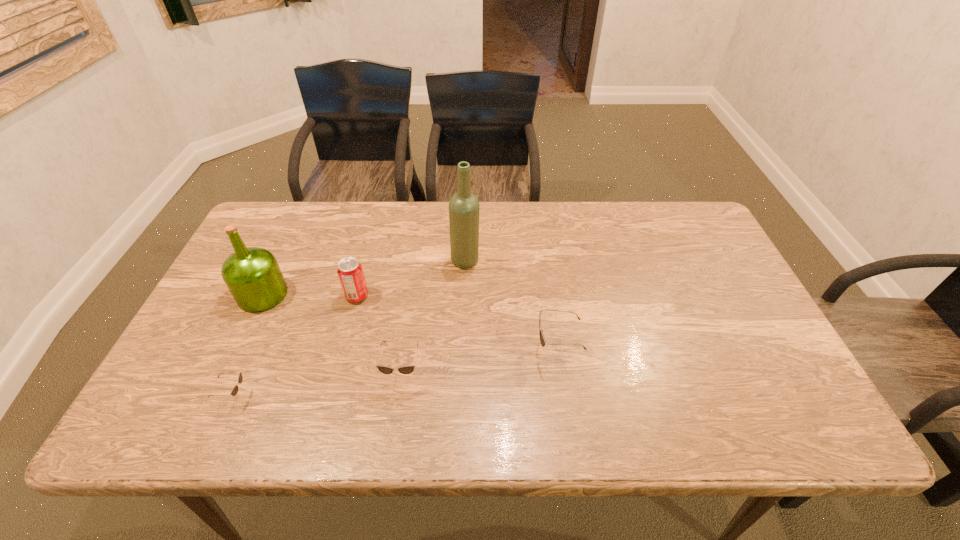
The image size is (960, 540). I want to click on vacant space that's between the rightmost sunglasses and the olive oil, so click(x=410, y=322).

The height and width of the screenshot is (540, 960). What are the coordinates of `free space between the fifth shortest object and the soda` in the screenshot? It's located at (310, 295).

You are a GUI agent. You are given a task and a screenshot of the screen. Output one action in this format:
    pyautogui.click(x=<x>, y=<y>)
    Task: Click on the blank region between the rightmost sunglasses and the farthest object
    This screenshot has width=960, height=540.
    Given the screenshot: What is the action you would take?
    pyautogui.click(x=511, y=306)

Where is `vacant space that's between the farthest object and the shortest object`? vacant space that's between the farthest object and the shortest object is located at coordinates (349, 328).

I want to click on unoccupied position between the second shortest object and the farthest object, so click(434, 316).

This screenshot has width=960, height=540. I want to click on vacant space that is in between the fourth object from right to left and the rightmost object, so click(457, 323).

Choose which object is the third nearest neighbor to the shortest sunglasses. Please provide its 2D coordinates. Your answer should be formatted as a tuple, i.e. [(x, y)], where the tuple contains the x and y coordinates of a point satisfying the conditions above.

[(349, 270)]

Locate which object ranks fourth in proximity to the shortest sunglasses. Please provide its 2D coordinates. Your answer should be formatted as a tuple, i.e. [(x, y)], where the tuple contains the x and y coordinates of a point satisfying the conditions above.

[(464, 207)]

Identify which sunglasses is located as the nearest to the rightmost object. Please provide its 2D coordinates. Your answer should be formatted as a tuple, i.e. [(x, y)], where the tuple contains the x and y coordinates of a point satisfying the conditions above.

[(408, 369)]

Identify which sunglasses is the second nearest to the olive oil. Please provide its 2D coordinates. Your answer should be formatted as a tuple, i.e. [(x, y)], where the tuple contains the x and y coordinates of a point satisfying the conditions above.

[(408, 369)]